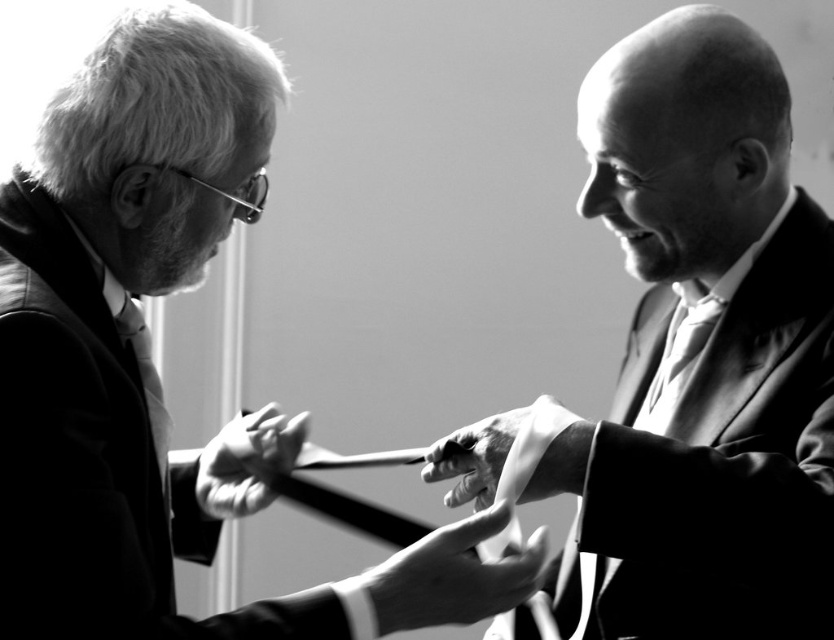
Question: Which of the following is the closest to the observer?

Choices:
 (A) (84, 332)
 (B) (149, 362)

Answer: (A)

Question: Is matte black suit at left smaller than silky white tie at center?

Choices:
 (A) no
 (B) yes

Answer: (A)

Question: Can you confirm if smooth fabric tie at center is thinner than matte black tie at left?

Choices:
 (A) no
 (B) yes

Answer: (A)

Question: Which object appears farthest from the camera in this image?

Choices:
 (A) smooth fabric tie at center
 (B) matte black suit at left

Answer: (A)

Question: Which of the following is the closest to the observer?

Choices:
 (A) smooth silk tie at right
 (B) matte black tie at left
 (C) matte black suit at left

Answer: (C)

Question: Can you confirm if matte black suit at left is positioned to the left of silky white tie at center?

Choices:
 (A) yes
 (B) no

Answer: (A)